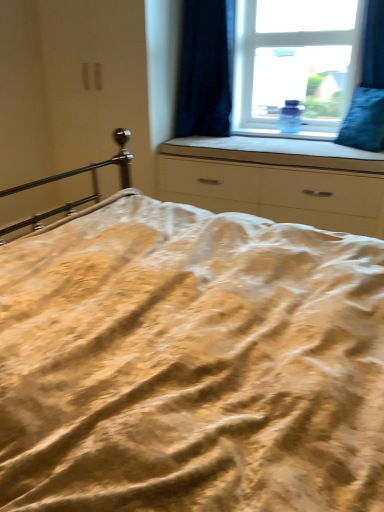
Question: Should I look upward or downward to see white matte chest of drawers at center?

Choices:
 (A) down
 (B) up

Answer: (B)

Question: Is dark blue velvet curtain at upper right further to the viewer compared to blue velvet pillow at right?

Choices:
 (A) no
 (B) yes

Answer: (B)

Question: Does dark blue velvet curtain at upper right appear on the right side of blue velvet pillow at right?

Choices:
 (A) yes
 (B) no

Answer: (B)

Question: From a real-world perspective, is dark blue velvet curtain at upper right located beneath blue velvet pillow at right?

Choices:
 (A) yes
 (B) no

Answer: (B)

Question: Considering the relative sizes of dark blue velvet curtain at upper right and blue velvet pillow at right in the image provided, is dark blue velvet curtain at upper right bigger than blue velvet pillow at right?

Choices:
 (A) no
 (B) yes

Answer: (B)

Question: Is dark blue velvet curtain at upper right directly adjacent to blue velvet pillow at right?

Choices:
 (A) yes
 (B) no

Answer: (B)

Question: Is dark blue velvet curtain at upper right taller than blue velvet pillow at right?

Choices:
 (A) yes
 (B) no

Answer: (A)

Question: From a real-world perspective, is transparent glass window at upper center positioned over white fabric at center based on gravity?

Choices:
 (A) no
 (B) yes

Answer: (B)

Question: Considering the relative sizes of transparent glass window at upper center and white fabric at center in the image provided, is transparent glass window at upper center thinner than white fabric at center?

Choices:
 (A) no
 (B) yes

Answer: (B)

Question: Is transparent glass window at upper center not close to white fabric at center?

Choices:
 (A) no
 (B) yes

Answer: (A)

Question: Can you confirm if transparent glass window at upper center is bigger than white fabric at center?

Choices:
 (A) no
 (B) yes

Answer: (A)

Question: Is transparent glass window at upper center positioned behind white fabric at center?

Choices:
 (A) yes
 (B) no

Answer: (A)

Question: Is transparent glass window at upper center located outside white fabric at center?

Choices:
 (A) no
 (B) yes

Answer: (B)

Question: Is white fabric at center facing away from dark blue velvet curtain at upper right?

Choices:
 (A) yes
 (B) no

Answer: (B)